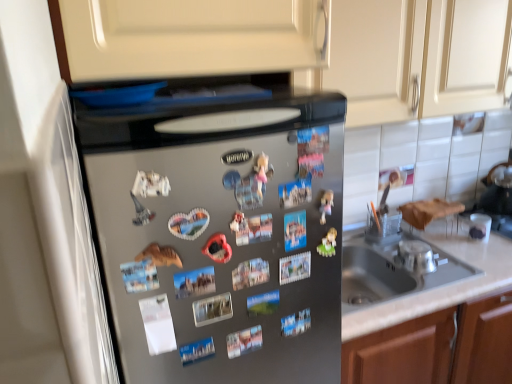
Question: Does matte plastic toy at center have a greater width compared to silver metallic bowl at sink?

Choices:
 (A) yes
 (B) no

Answer: (B)

Question: Is matte plastic toy at center behind silver metallic bowl at sink?

Choices:
 (A) yes
 (B) no

Answer: (B)

Question: From a real-world perspective, is matte plastic toy at center positioned under silver metallic bowl at sink based on gravity?

Choices:
 (A) yes
 (B) no

Answer: (B)

Question: Is matte plastic toy at center completely or partially outside of silver metallic bowl at sink?

Choices:
 (A) no
 (B) yes

Answer: (B)

Question: Considering the relative sizes of matte plastic toy at center and silver metallic bowl at sink in the image provided, is matte plastic toy at center shorter than silver metallic bowl at sink?

Choices:
 (A) no
 (B) yes

Answer: (A)

Question: Can you confirm if matte plastic toy at center is smaller than silver metallic bowl at sink?

Choices:
 (A) no
 (B) yes

Answer: (B)

Question: Is satin silver refrigerator at center at the right side of matte plastic toy at center?

Choices:
 (A) no
 (B) yes

Answer: (A)

Question: From the image's perspective, is satin silver refrigerator at center below matte plastic toy at center?

Choices:
 (A) no
 (B) yes

Answer: (B)

Question: Does satin silver refrigerator at center contain matte plastic toy at center?

Choices:
 (A) no
 (B) yes

Answer: (B)

Question: Is satin silver refrigerator at center further to camera compared to matte plastic toy at center?

Choices:
 (A) yes
 (B) no

Answer: (B)

Question: Does satin silver refrigerator at center have a greater width compared to matte plastic toy at center?

Choices:
 (A) no
 (B) yes

Answer: (B)

Question: From a real-world perspective, is satin silver refrigerator at center physically above matte plastic toy at center?

Choices:
 (A) no
 (B) yes

Answer: (A)

Question: Is matte cream cabinet at upper center completely or partially inside matte plastic toy at center?

Choices:
 (A) no
 (B) yes

Answer: (A)